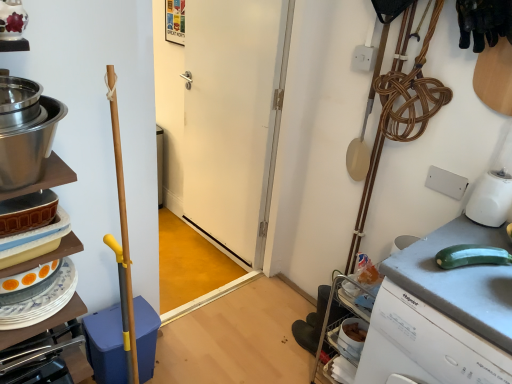
Where is `vacant space situated above blue plastic dish washer at left (from a real-world perspective)`? The image size is (512, 384). vacant space situated above blue plastic dish washer at left (from a real-world perspective) is located at coordinates (111, 325).